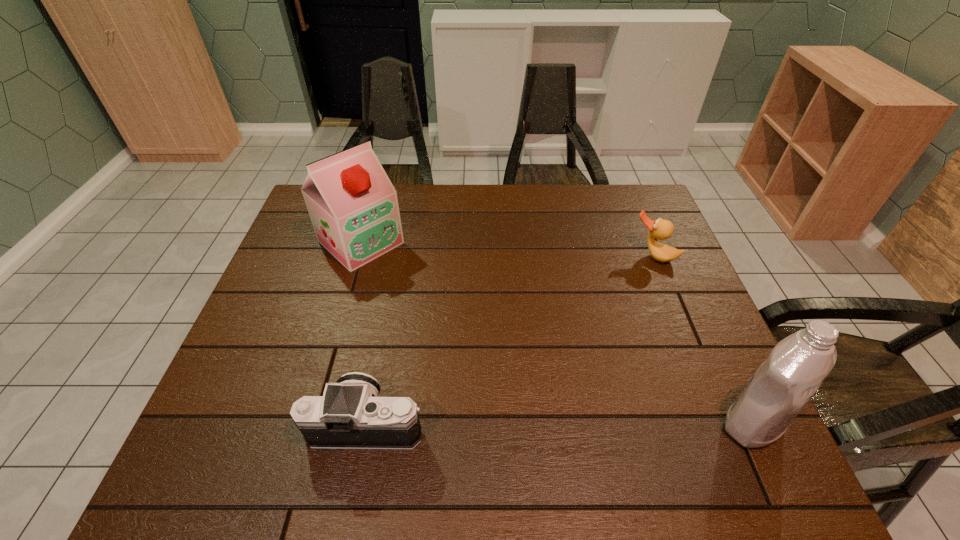
The image size is (960, 540). I want to click on free space located with the cap open on the soya milk, so click(432, 304).

Locate an element on the screen. This screenshot has width=960, height=540. vacant space positioned with the cap open on the soya milk is located at coordinates (416, 289).

Locate an element on the screen. The height and width of the screenshot is (540, 960). object that is at the far edge is located at coordinates (353, 206).

Where is `camera at the near edge`? The width and height of the screenshot is (960, 540). camera at the near edge is located at coordinates (350, 415).

Locate an element on the screen. The width and height of the screenshot is (960, 540). detergent located in the near edge section of the desktop is located at coordinates (783, 384).

Identify the location of object present at the left edge. (353, 206).

The width and height of the screenshot is (960, 540). I want to click on detergent located at the right edge, so click(x=783, y=384).

Where is `duck at the right edge`? duck at the right edge is located at coordinates point(660,229).

Where is `object that is at the far left corner`? The width and height of the screenshot is (960, 540). object that is at the far left corner is located at coordinates (353, 206).

Locate an element on the screen. object located at the near right corner is located at coordinates (783, 384).